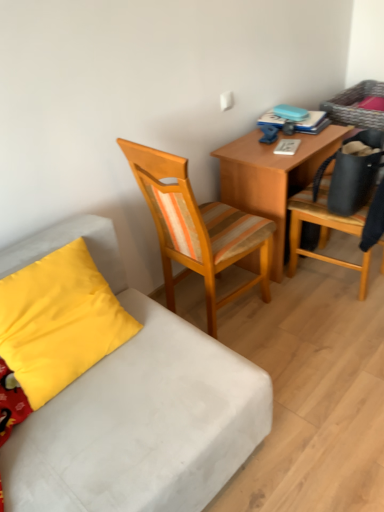
The width and height of the screenshot is (384, 512). What are the coordinates of `free spot in front of wooden chair at right, the second chair viewed from the left` in the screenshot? It's located at (339, 332).